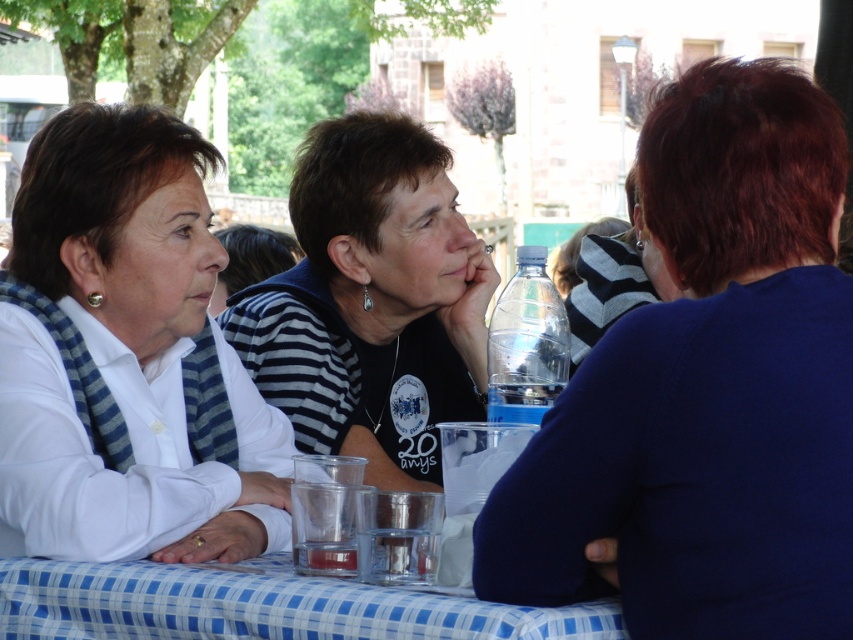
You are standing at the center of the image and want to locate the white matte shirt at left. In which direction should you look to find it?

You should look to the left to find the white matte shirt at left as it is positioned at point [126,356].

You are a photographer trying to capture a closeup of the matte black shirt at center and the blue checkered tablecloth at lower center. Which object should you zoom in on to ensure both are in focus without moving the camera?

The matte black shirt at center is larger in size than the blue checkered tablecloth at lower center, so you should zoom in on the matte black shirt at center to ensure both are in focus without moving the camera.